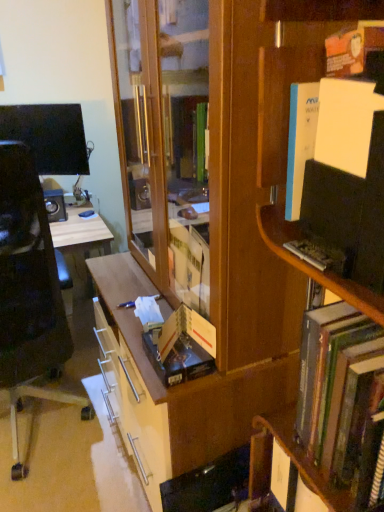
Question: Should I look upward or downward to see wooden bookcase at center?

Choices:
 (A) up
 (B) down

Answer: (B)

Question: From a real-world perspective, is wooden bookshelf at right beneath hardcover book at center?

Choices:
 (A) yes
 (B) no

Answer: (B)

Question: Can you confirm if wooden bookshelf at right is thinner than hardcover book at center?

Choices:
 (A) no
 (B) yes

Answer: (A)

Question: Would you say wooden bookshelf at right is a long distance from hardcover book at center?

Choices:
 (A) no
 (B) yes

Answer: (A)

Question: Is wooden bookshelf at right behind hardcover book at center?

Choices:
 (A) no
 (B) yes

Answer: (A)

Question: Is wooden bookshelf at right bigger than hardcover book at center?

Choices:
 (A) yes
 (B) no

Answer: (A)

Question: Considering the relative sizes of wooden bookshelf at right and hardcover book at center in the image provided, is wooden bookshelf at right shorter than hardcover book at center?

Choices:
 (A) no
 (B) yes

Answer: (A)

Question: Can you confirm if wooden bookshelf at right is positioned to the right of wooden bookcase at center?

Choices:
 (A) yes
 (B) no

Answer: (A)

Question: From a real-world perspective, is wooden bookshelf at right on wooden bookcase at center?

Choices:
 (A) no
 (B) yes

Answer: (B)

Question: Does wooden bookshelf at right lie in front of wooden bookcase at center?

Choices:
 (A) yes
 (B) no

Answer: (A)

Question: Could you tell me if wooden bookshelf at right is turned towards wooden bookcase at center?

Choices:
 (A) yes
 (B) no

Answer: (B)

Question: Is wooden bookshelf at right looking in the opposite direction of wooden bookcase at center?

Choices:
 (A) yes
 (B) no

Answer: (B)

Question: From the image's perspective, is wooden bookshelf at right on wooden bookcase at center?

Choices:
 (A) yes
 (B) no

Answer: (B)

Question: Is black plastic chair at left not near wooden bookcase at center?

Choices:
 (A) yes
 (B) no

Answer: (B)